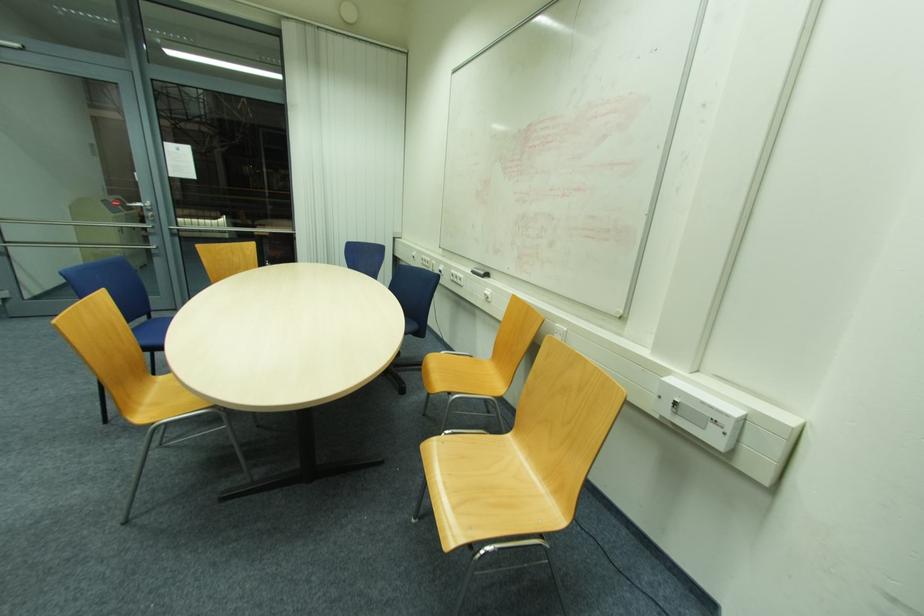
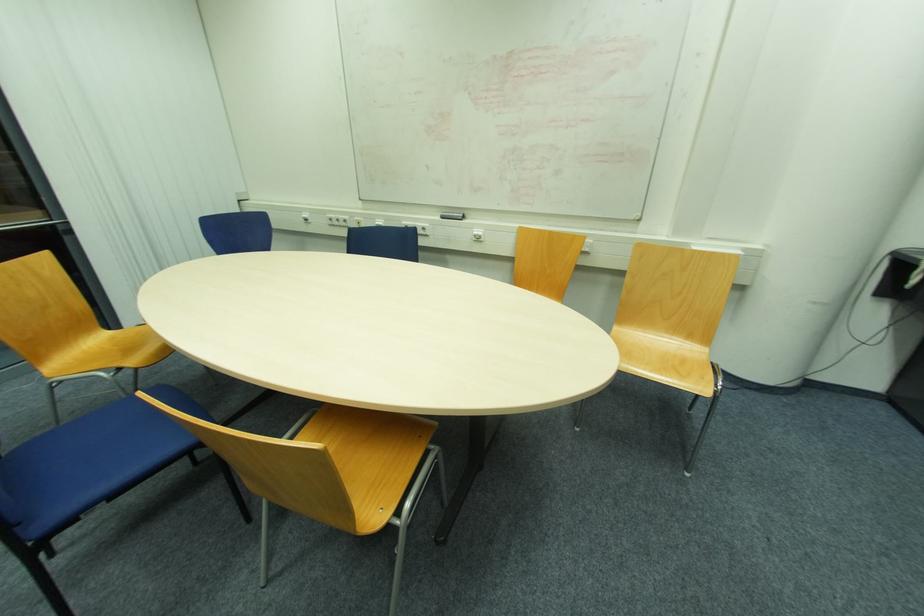
The point at (x=488, y=293) is marked in the first image. Where is the corresponding point in the second image?

(477, 233)